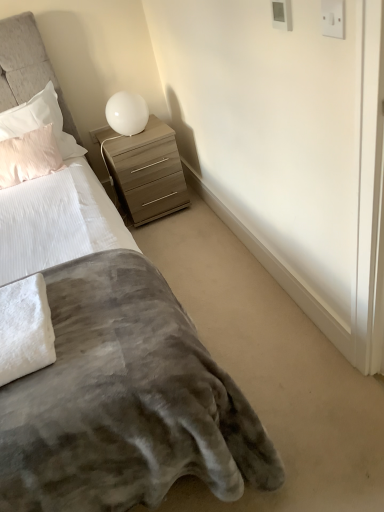
Identify the location of matte wood chest of drawers at upper right. (145, 170).

Measure the distance between point (26,140) and camera.

7.37 feet.

Where is `matte wood chest of drawers at upper right`? matte wood chest of drawers at upper right is located at coordinates (145, 170).

Is white plastic electric outlet at upper right, arranged as the 2th electric outlet when ordered from the bottom, at the right side of matte wood chest of drawers at upper right?

Yes, white plastic electric outlet at upper right, arranged as the 2th electric outlet when ordered from the bottom, is to the right of matte wood chest of drawers at upper right.

Between white plastic electric outlet at upper right, the 1th electric outlet from the left, and matte wood chest of drawers at upper right, which one has less height?

white plastic electric outlet at upper right, the 1th electric outlet from the left.

Is matte wood chest of drawers at upper right surrounded by white plastic electric outlet at upper right, placed as the first electric outlet when sorted from back to front?

Definitely not — matte wood chest of drawers at upper right is not inside white plastic electric outlet at upper right, placed as the first electric outlet when sorted from back to front.

From the picture: How many degrees apart are the facing directions of white fluffy towel at lower left and pink satin pillow at upper left, which is the first pillow from top to bottom?

The angular difference between white fluffy towel at lower left and pink satin pillow at upper left, which is the first pillow from top to bottom, is 1.61 degrees.

Based on the photo, would you say white fluffy towel at lower left is to the left or to the right of pink satin pillow at upper left, which is counted as the second pillow, starting from the bottom, in the picture?

Based on their positions, white fluffy towel at lower left is located to the right of pink satin pillow at upper left, which is counted as the second pillow, starting from the bottom.

Considering the relative sizes of white fluffy towel at lower left and pink satin pillow at upper left, which is the first pillow from top to bottom, in the image provided, is white fluffy towel at lower left wider than pink satin pillow at upper left, which is the first pillow from top to bottom,?

Yes, white fluffy towel at lower left is wider than pink satin pillow at upper left, which is the first pillow from top to bottom.

Which of these two, white plastic electric outlet at upper right, the second electric outlet positioned from the front, or velvet gray blanket at lower left, stands taller?

Standing taller between the two is velvet gray blanket at lower left.

How distant is white plastic electric outlet at upper right, the 2th electric outlet viewed from the right, from velvet gray blanket at lower left?

white plastic electric outlet at upper right, the 2th electric outlet viewed from the right, is 3.59 feet from velvet gray blanket at lower left.

From the image's perspective, is white plastic electric outlet at upper right, marked as the first electric outlet in a top-to-bottom arrangement, below velvet gray blanket at lower left?

Incorrect, from the image's perspective, white plastic electric outlet at upper right, marked as the first electric outlet in a top-to-bottom arrangement, is higher than velvet gray blanket at lower left.

Is pale pink plush pillow at upper left, the 1th pillow in the bottom-to-top sequence, not within white plastic electric outlet at upper right, positioned as the first electric outlet in front-to-back order?

That's correct, pale pink plush pillow at upper left, the 1th pillow in the bottom-to-top sequence, is outside of white plastic electric outlet at upper right, positioned as the first electric outlet in front-to-back order.

Does pale pink plush pillow at upper left, the 1th pillow in the bottom-to-top sequence, turn towards white plastic electric outlet at upper right, which is the first electric outlet in bottom-to-top order?

No, pale pink plush pillow at upper left, the 1th pillow in the bottom-to-top sequence, is not oriented towards white plastic electric outlet at upper right, which is the first electric outlet in bottom-to-top order.

Considering the positions of objects pale pink plush pillow at upper left, the 1th pillow in the bottom-to-top sequence, and white plastic electric outlet at upper right, placed as the second electric outlet when sorted from top to bottom, in the image provided, who is behind, pale pink plush pillow at upper left, the 1th pillow in the bottom-to-top sequence, or white plastic electric outlet at upper right, placed as the second electric outlet when sorted from top to bottom,?

pale pink plush pillow at upper left, the 1th pillow in the bottom-to-top sequence, is more distant.

Between pale pink plush pillow at upper left, which appears as the second pillow when viewed from the top, and white plastic electric outlet at upper right, the first electric outlet viewed from the right, which one has larger width?

pale pink plush pillow at upper left, which appears as the second pillow when viewed from the top.

Does pale pink plush pillow at upper left, the 1th pillow in the bottom-to-top sequence, have a lesser height compared to velvet gray blanket at lower left?

Yes.

From the image's perspective, is pale pink plush pillow at upper left, which appears as the second pillow when viewed from the top, below velvet gray blanket at lower left?

No.

Considering the relative sizes of pale pink plush pillow at upper left, which appears as the second pillow when viewed from the top, and velvet gray blanket at lower left in the image provided, is pale pink plush pillow at upper left, which appears as the second pillow when viewed from the top, wider than velvet gray blanket at lower left?

In fact, pale pink plush pillow at upper left, which appears as the second pillow when viewed from the top, might be narrower than velvet gray blanket at lower left.

Is white plastic electric outlet at upper right, the second electric outlet positioned from the left, next to pink satin pillow at upper left, which is counted as the second pillow, starting from the bottom?

No, white plastic electric outlet at upper right, the second electric outlet positioned from the left, is not next to pink satin pillow at upper left, which is counted as the second pillow, starting from the bottom.

Which of these two, white plastic electric outlet at upper right, which is the first electric outlet in bottom-to-top order, or pink satin pillow at upper left, which is counted as the second pillow, starting from the bottom, is thinner?

white plastic electric outlet at upper right, which is the first electric outlet in bottom-to-top order, is thinner.

Which of these two, white plastic electric outlet at upper right, positioned as the first electric outlet in front-to-back order, or pink satin pillow at upper left, which is the first pillow from top to bottom, stands taller?

With more height is pink satin pillow at upper left, which is the first pillow from top to bottom.

How many degrees apart are the facing directions of white plastic electric outlet at upper right, the first electric outlet viewed from the right, and pink satin pillow at upper left, which is counted as the second pillow, starting from the bottom?

The facing directions of white plastic electric outlet at upper right, the first electric outlet viewed from the right, and pink satin pillow at upper left, which is counted as the second pillow, starting from the bottom, are 91.7 degrees apart.

From a real-world perspective, between pink satin pillow at upper left, which is counted as the second pillow, starting from the bottom, and white fluffy towel at lower left, who is vertically lower?

white fluffy towel at lower left, from a real-world perspective.

How many degrees apart are the facing directions of pink satin pillow at upper left, which is the first pillow from top to bottom, and white fluffy towel at lower left?

1.61 degrees.

Locate an element on the screen. The image size is (384, 512). material below the pink satin pillow at upper left, which is the first pillow from top to bottom (from a real-world perspective) is located at coordinates (25, 328).

I want to click on electric outlet that is the 1st one above the matte wood chest of drawers at upper right (from a real-world perspective), so click(x=282, y=14).

This screenshot has width=384, height=512. I want to click on material on the right side of pink satin pillow at upper left, which is counted as the second pillow, starting from the bottom, so click(25, 328).

Considering their positions, is white glossy table lamp at upper right positioned closer to velvet gray blanket at lower left than white plastic electric outlet at upper right, which is the first electric outlet in bottom-to-top order?

Among the two, white plastic electric outlet at upper right, which is the first electric outlet in bottom-to-top order, is located nearer to velvet gray blanket at lower left.

From the image, which object appears to be farther from white plastic electric outlet at upper right, which is the second electric outlet in back-to-front order, velvet gray blanket at lower left or white plastic electric outlet at upper right, the second electric outlet positioned from the front?

velvet gray blanket at lower left.

Considering their positions, is matte wood chest of drawers at upper right positioned further to white plastic electric outlet at upper right, positioned as the first electric outlet in front-to-back order, than white plastic electric outlet at upper right, marked as the first electric outlet in a top-to-bottom arrangement?

Among the two, matte wood chest of drawers at upper right is located further to white plastic electric outlet at upper right, positioned as the first electric outlet in front-to-back order.

Based on their spatial positions, is white glossy table lamp at upper right or white fluffy towel at lower left further from velvet gray blanket at lower left?

The object further to velvet gray blanket at lower left is white glossy table lamp at upper right.

Based on their spatial positions, is velvet gray blanket at lower left or matte wood chest of drawers at upper right closer to pink satin pillow at upper left, which is the first pillow from top to bottom?

matte wood chest of drawers at upper right is positioned closer to the anchor pink satin pillow at upper left, which is the first pillow from top to bottom.

Looking at the image, which one is located further to white fluffy towel at lower left, velvet gray blanket at lower left or pink satin pillow at upper left, which is the first pillow from top to bottom?

Among the two, pink satin pillow at upper left, which is the first pillow from top to bottom, is located further to white fluffy towel at lower left.

Considering their positions, is pink satin pillow at upper left, which is the first pillow from top to bottom, positioned further to matte wood chest of drawers at upper right than white plastic electric outlet at upper right, the 2th electric outlet viewed from the right?

Among the two, white plastic electric outlet at upper right, the 2th electric outlet viewed from the right, is located further to matte wood chest of drawers at upper right.

Considering their positions, is white plastic electric outlet at upper right, the second electric outlet positioned from the front, positioned further to pink satin pillow at upper left, which is counted as the second pillow, starting from the bottom, than pale pink plush pillow at upper left, which appears as the second pillow when viewed from the top?

The object further to pink satin pillow at upper left, which is counted as the second pillow, starting from the bottom, is white plastic electric outlet at upper right, the second electric outlet positioned from the front.

Image resolution: width=384 pixels, height=512 pixels. I want to click on material between white plastic electric outlet at upper right, which is the second electric outlet in back-to-front order, and pale pink plush pillow at upper left, the 1th pillow in the bottom-to-top sequence, along the z-axis, so click(x=25, y=328).

You are a GUI agent. You are given a task and a screenshot of the screen. Output one action in this format:
    pyautogui.click(x=<x>, y=<y>)
    Task: Click on the table lamp between velvet gray blanket at lower left and matte wood chest of drawers at upper right in the front-back direction
    This screenshot has height=512, width=384.
    Given the screenshot: What is the action you would take?
    pyautogui.click(x=127, y=113)

Find the location of `material between white plastic electric outlet at upper right, positioned as the first electric outlet in front-to-back order, and white glossy table lamp at upper right, along the z-axis`. material between white plastic electric outlet at upper right, positioned as the first electric outlet in front-to-back order, and white glossy table lamp at upper right, along the z-axis is located at coordinates (25, 328).

You are a GUI agent. You are given a task and a screenshot of the screen. Output one action in this format:
    pyautogui.click(x=<x>, y=<y>)
    Task: Click on the material between velvet gray blanket at lower left and white glossy table lamp at upper right from front to back
    The image size is (384, 512).
    Given the screenshot: What is the action you would take?
    pyautogui.click(x=25, y=328)